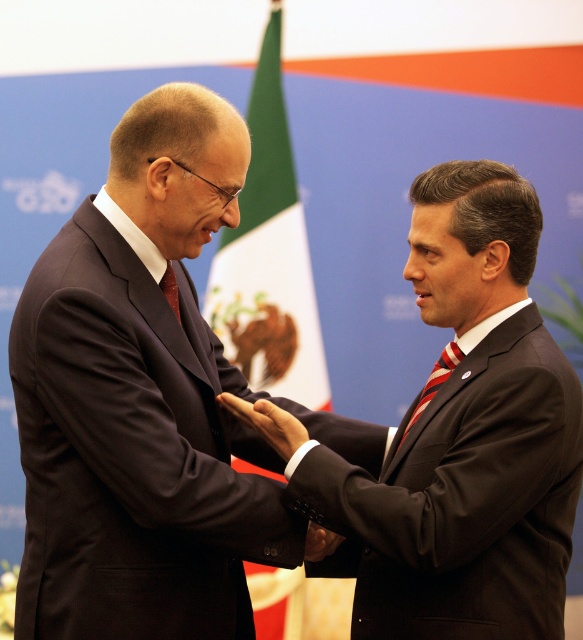
Question: Where is dark suit at center located in relation to striped fabric tie at center in the image?

Choices:
 (A) left
 (B) right

Answer: (B)

Question: Which object is positioned farthest from the dark suit at left?

Choices:
 (A) striped fabric tie at center
 (B) green fabric flag at center
 (C) matte black suit at center
 (D) smooth skin hand at center

Answer: (B)

Question: Does dark suit at center appear on the right side of striped fabric tie at center?

Choices:
 (A) no
 (B) yes

Answer: (B)

Question: Is dark suit at center wider than matte black suit at center?

Choices:
 (A) yes
 (B) no

Answer: (A)

Question: Which point is farther to the camera?

Choices:
 (A) smooth skin hand at center
 (B) dark suit at left
 (C) dark suit at center
 (D) green fabric flag at center

Answer: (D)

Question: Which object appears farthest from the camera in this image?

Choices:
 (A) smooth skin hand at center
 (B) striped fabric tie at center
 (C) matte black suit at center
 (D) matte red tie at center

Answer: (B)